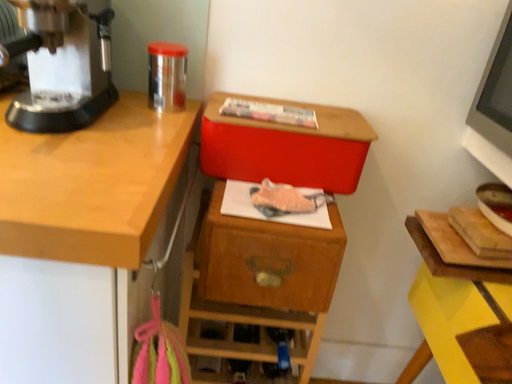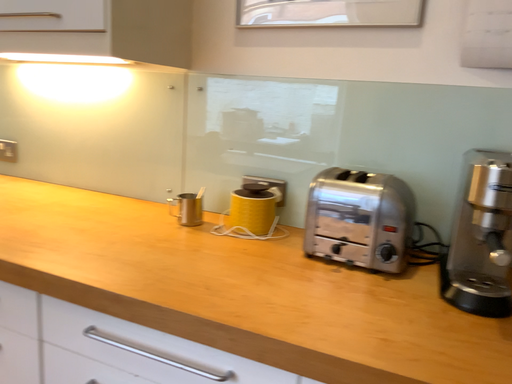
Question: Which way did the camera rotate in the video?

Choices:
 (A) rotated upward
 (B) rotated downward

Answer: (A)